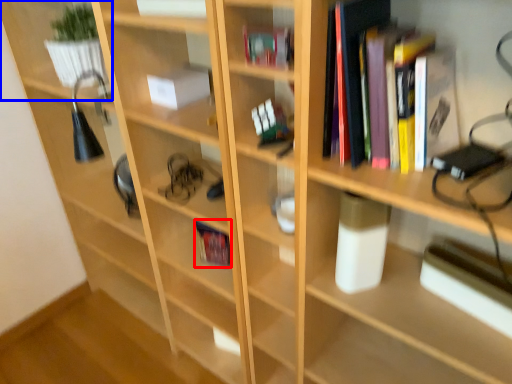
Question: Which object appears farthest to the camera in this image, book (highlighted by a red box) or shelf (highlighted by a blue box)?

Choices:
 (A) book
 (B) shelf

Answer: (A)